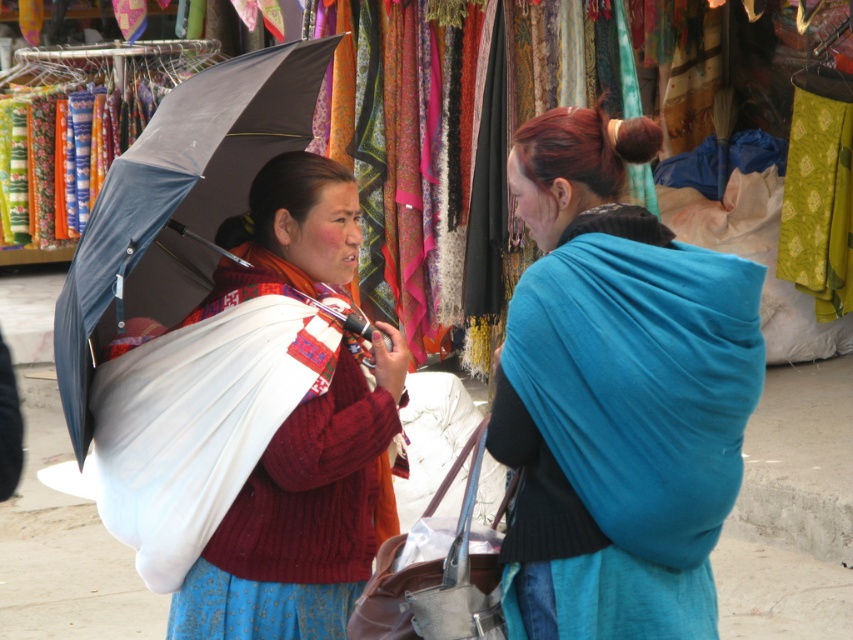
You are a customer at the market and want to buy both the matte blue shawl at center and the dark gray fabric umbrella at left. The vendor says that the smaller item can be placed inside the larger one for easy carrying. Which item can be placed inside the other?

The matte blue shawl at center has a smaller size compared to dark gray fabric umbrella at left, so the matte blue shawl at center can be placed inside the dark gray fabric umbrella at left for easy carrying.

You are a vendor at the market and need to fold both the matte blue shawl at center and the matte white shawl at center to store them. Which shawl will require a smaller storage space?

The matte blue shawl at center requires a smaller storage space because it occupies less space than the matte white shawl at center.